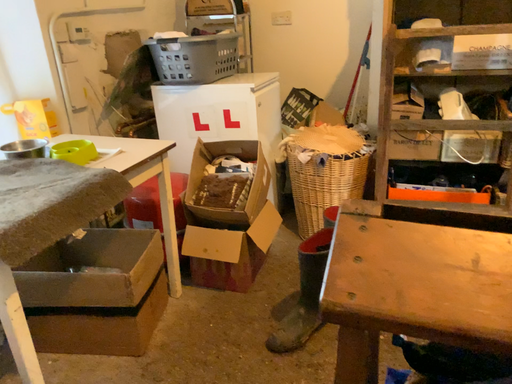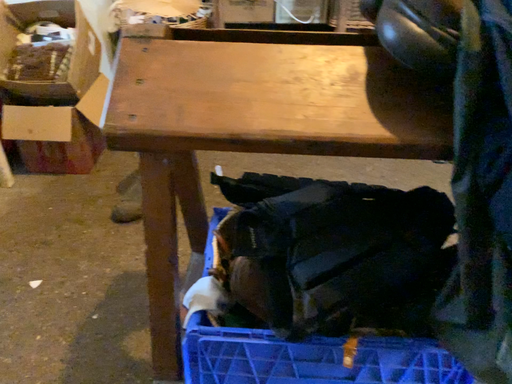
Question: How did the camera likely rotate when shooting the video?

Choices:
 (A) rotated right
 (B) rotated left

Answer: (A)